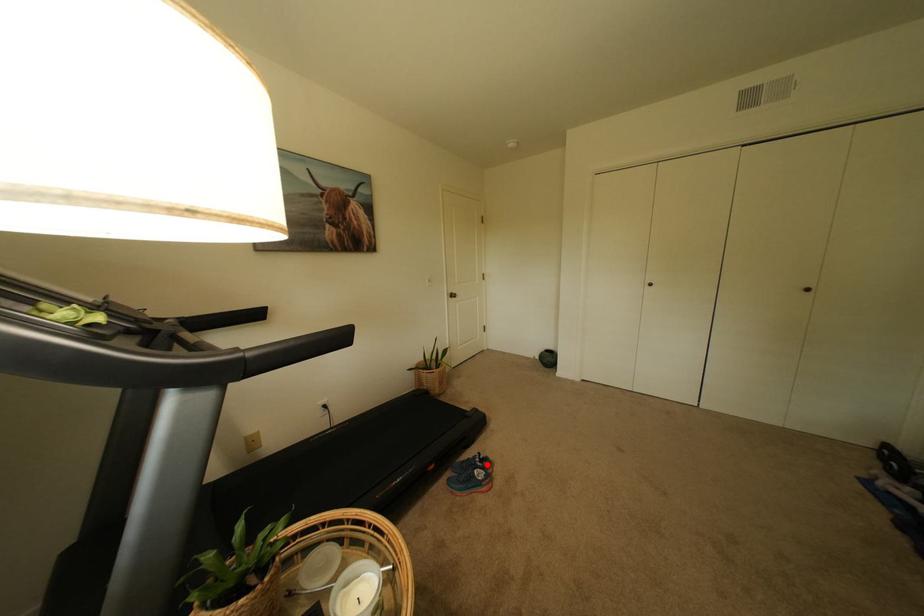
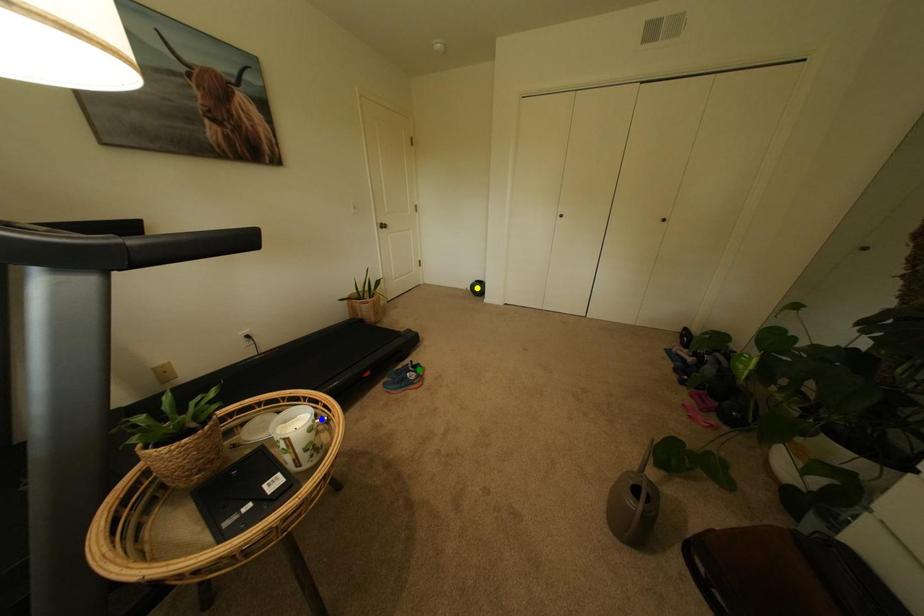
Question: I am providing you with two images of the same scene from different viewpoints. A red point is marked on the first image. You are given multiple points on the second image. In image 2, which mark is for the same physical point as the one in image 1?

Choices:
 (A) green point
 (B) yellow point
 (C) blue point

Answer: (A)